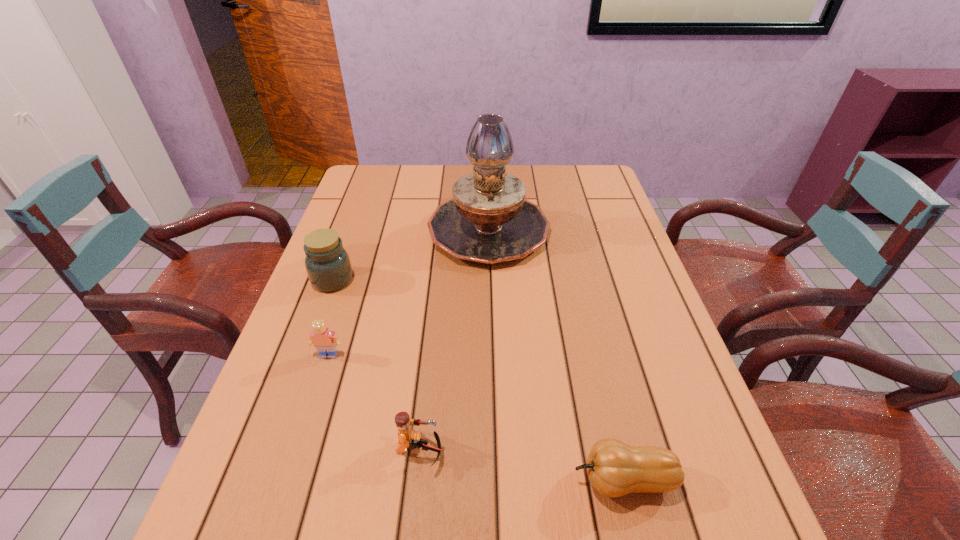
The width and height of the screenshot is (960, 540). I want to click on vacant space that is in between the gourd and the jar, so click(x=478, y=380).

Locate which object is the second closest to the second tallest object. Please provide its 2D coordinates. Your answer should be formatted as a tuple, i.e. [(x, y)], where the tuple contains the x and y coordinates of a point satisfying the conditions above.

[(322, 338)]

Image resolution: width=960 pixels, height=540 pixels. What are the coordinates of `the fourth closest object to the tallest object` in the screenshot? It's located at (614, 468).